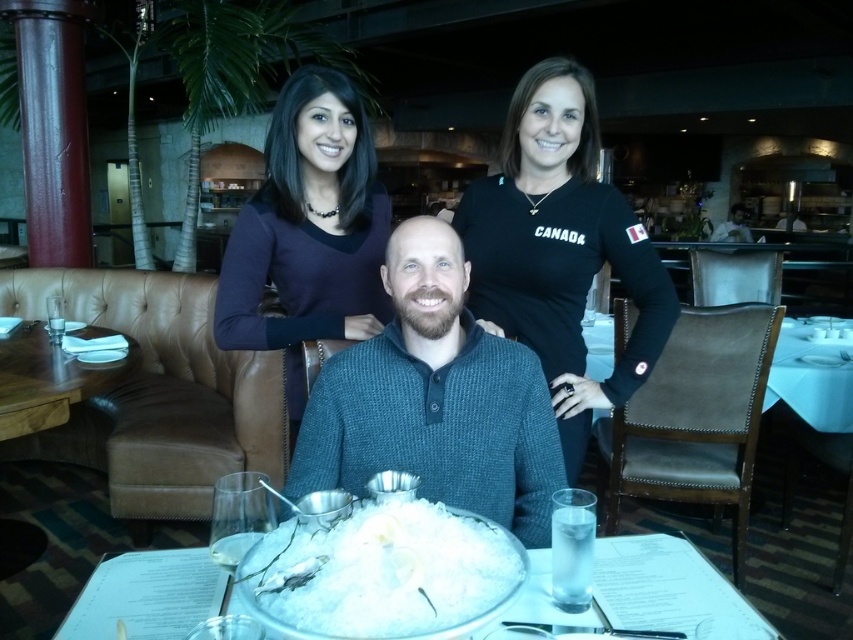
Looking at this image, is black jersey at upper right taller than white frosted plate at center?

Yes, black jersey at upper right is taller than white frosted plate at center.

How much distance is there between black jersey at upper right and white frosted plate at center?

28.27 inches

Who is more distant from viewer, (624, 256) or (183, 634)?

Point (624, 256)

Where is `black jersey at upper right`? The height and width of the screenshot is (640, 853). black jersey at upper right is located at coordinates (560, 248).

Between white ice at center and white frosted plate at center, which one appears on the left side from the viewer's perspective?

Result: white ice at center

Does white ice at center have a lesser width compared to white frosted plate at center?

Correct, white ice at center's width is less than white frosted plate at center's.

Does point (408, 528) lie behind point (534, 572)?

No, (408, 528) is in front of (534, 572).

Locate an element on the screen. This screenshot has width=853, height=640. white ice at center is located at coordinates (381, 573).

Is teal knitted sweater at center to the right of white frosted plate at center from the viewer's perspective?

No, teal knitted sweater at center is not to the right of white frosted plate at center.

Is teal knitted sweater at center smaller than white frosted plate at center?

No, teal knitted sweater at center is not smaller than white frosted plate at center.

Between point (527, 540) and point (167, 593), which one is positioned behind?

The point (527, 540) is more distant.

What are the coordinates of `teal knitted sweater at center` in the screenshot? It's located at (434, 400).